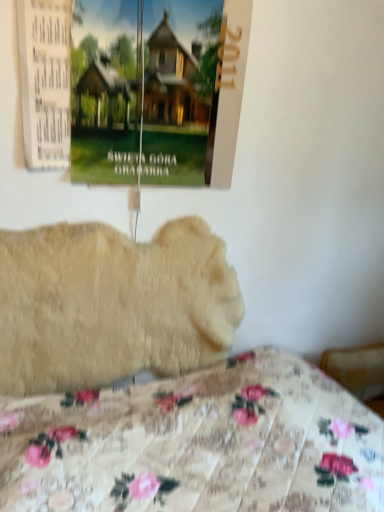
Question: Does matte paper poster at upper left lie behind fluffy beige dog at center?

Choices:
 (A) no
 (B) yes

Answer: (A)

Question: Does matte paper poster at upper left have a lesser height compared to fluffy beige dog at center?

Choices:
 (A) yes
 (B) no

Answer: (A)

Question: Would you say fluffy beige dog at center is part of matte paper poster at upper left's contents?

Choices:
 (A) yes
 (B) no

Answer: (B)

Question: Is matte paper poster at upper left far away from fluffy beige dog at center?

Choices:
 (A) no
 (B) yes

Answer: (A)

Question: From a real-world perspective, is matte paper poster at upper left positioned under fluffy beige dog at center based on gravity?

Choices:
 (A) yes
 (B) no

Answer: (B)

Question: Based on their positions, is fluffy beige dog at center located to the left or right of floral fabric bed at lower center?

Choices:
 (A) left
 (B) right

Answer: (A)

Question: Considering the positions of point (140, 253) and point (309, 412), is point (140, 253) closer or farther from the camera than point (309, 412)?

Choices:
 (A) closer
 (B) farther

Answer: (B)

Question: From a real-world perspective, is fluffy beige dog at center above or below floral fabric bed at lower center?

Choices:
 (A) above
 (B) below

Answer: (A)

Question: Considering the positions of fluffy beige dog at center and floral fabric bed at lower center in the image, is fluffy beige dog at center bigger or smaller than floral fabric bed at lower center?

Choices:
 (A) small
 (B) big

Answer: (A)

Question: From a real-world perspective, is matte paper poster at upper left above or below fluffy beige dog at center?

Choices:
 (A) below
 (B) above

Answer: (B)

Question: Relative to fluffy beige dog at center, is matte paper poster at upper left in front or behind?

Choices:
 (A) front
 (B) behind

Answer: (A)

Question: In the image, is matte paper poster at upper left on the left side or the right side of fluffy beige dog at center?

Choices:
 (A) left
 (B) right

Answer: (B)

Question: Based on their sizes in the image, would you say matte paper poster at upper left is bigger or smaller than fluffy beige dog at center?

Choices:
 (A) big
 (B) small

Answer: (B)

Question: Visually, is matte paper poster at upper left positioned to the left or to the right of floral fabric bed at lower center?

Choices:
 (A) right
 (B) left

Answer: (B)

Question: From the image's perspective, is matte paper poster at upper left located above or below floral fabric bed at lower center?

Choices:
 (A) above
 (B) below

Answer: (A)